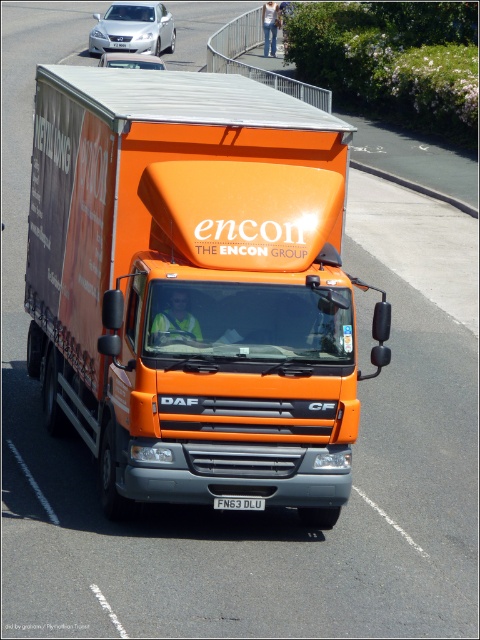
In the scene shown: Does silver metallic sedan at upper left have a lesser width compared to white plastic license plate at center?

In fact, silver metallic sedan at upper left might be wider than white plastic license plate at center.

Does silver metallic sedan at upper left have a lesser height compared to white plastic license plate at center?

No, silver metallic sedan at upper left is not shorter than white plastic license plate at center.

The image size is (480, 640). Identify the location of silver metallic sedan at upper left. (132, 28).

From the picture: Can you confirm if orange matte truck at center is thinner than metallic silver car at upper center?

Yes, orange matte truck at center is thinner than metallic silver car at upper center.

Is orange matte truck at center wider than metallic silver car at upper center?

No, orange matte truck at center is not wider than metallic silver car at upper center.

Is point (252, 364) behind point (123, 67)?

No, it is in front of (123, 67).

Locate an element on the screen. Image resolution: width=480 pixels, height=640 pixels. orange matte truck at center is located at coordinates (194, 288).

Is metallic silver car at upper center above white plastic license plate at center?

Yes.

Is point (126, 67) positioned behind point (254, 499)?

That is True.

What do you see at coordinates (131, 60) in the screenshot? The height and width of the screenshot is (640, 480). I see `metallic silver car at upper center` at bounding box center [131, 60].

This screenshot has height=640, width=480. Find the location of `metallic silver car at upper center`. metallic silver car at upper center is located at coordinates (131, 60).